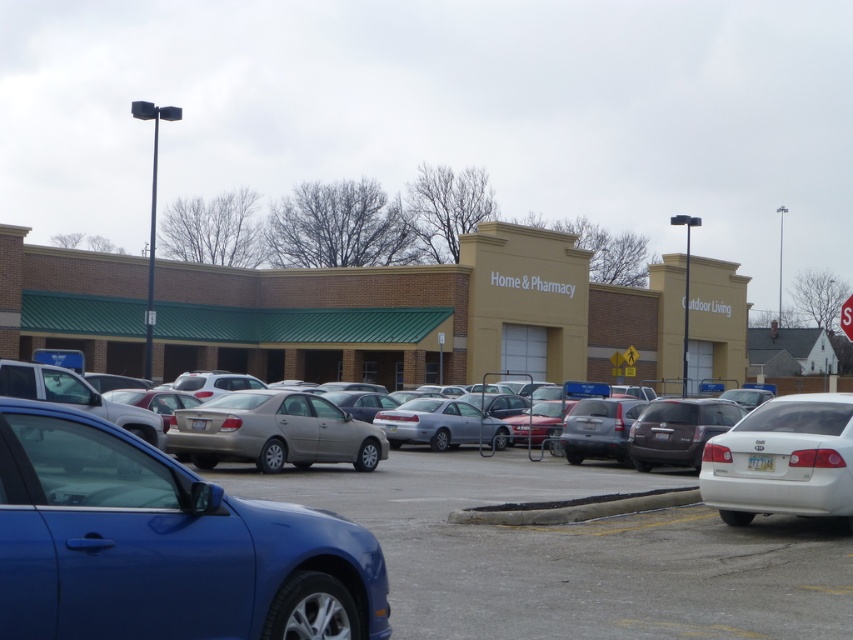
You are a driver approaching the parking lot and see the brick building at center and the metallic silver stop sign at upper right. Which object is positioned higher in the image?

The brick building at center is located above the metallic silver stop sign at upper right, so the brick building at center is positioned higher in the image.